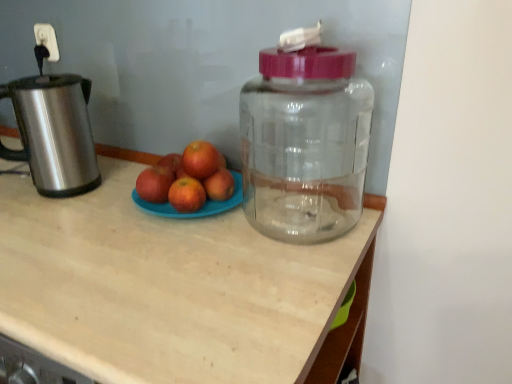
At what (x,y) coordinates should I click in order to perform the action: click on vacant point above matte plastic plate of apples at center (from a real-world perspective). Please return your answer as a coordinate pair (x, y). This screenshot has height=384, width=512. Looking at the image, I should click on (73, 221).